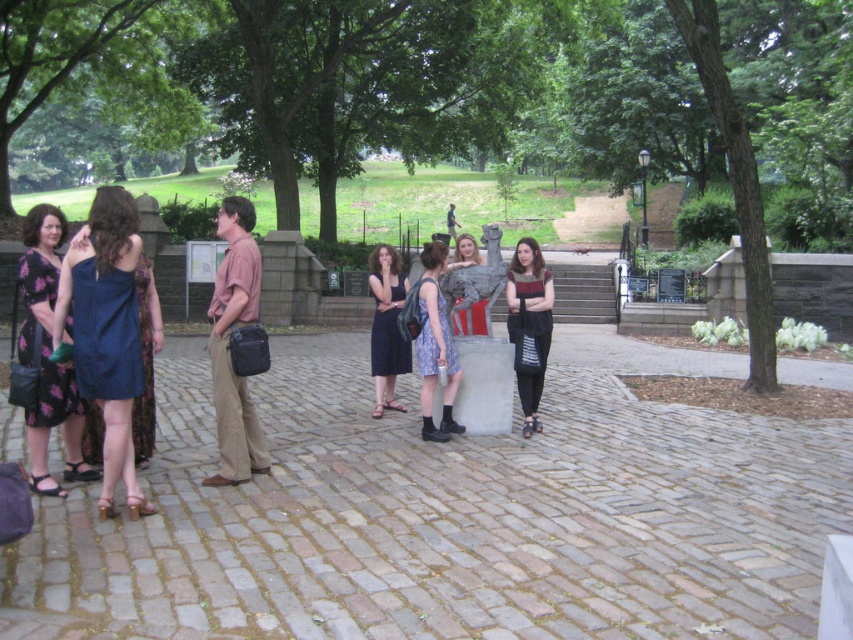
Question: Which point appears closest to the camera in this image?

Choices:
 (A) (438, 330)
 (B) (45, 321)

Answer: (B)

Question: Which of these objects is positioned closest to the matte blue dress at left?

Choices:
 (A) floral print dress at left
 (B) printed cotton dress at center
 (C) matte black dress at center

Answer: (A)

Question: Observing the image, what is the correct spatial positioning of striped fabric dress at center in reference to printed cotton dress at center?

Choices:
 (A) left
 (B) right

Answer: (B)

Question: Is floral print dress at left wider than matte black dress at center?

Choices:
 (A) yes
 (B) no

Answer: (A)

Question: Which is nearer to the matte blue dress at left?

Choices:
 (A) floral print dress at left
 (B) matte black dress at center
 (C) striped fabric dress at center

Answer: (A)

Question: Observing the image, what is the correct spatial positioning of floral print dress at left in reference to striped fabric dress at center?

Choices:
 (A) left
 (B) right

Answer: (A)